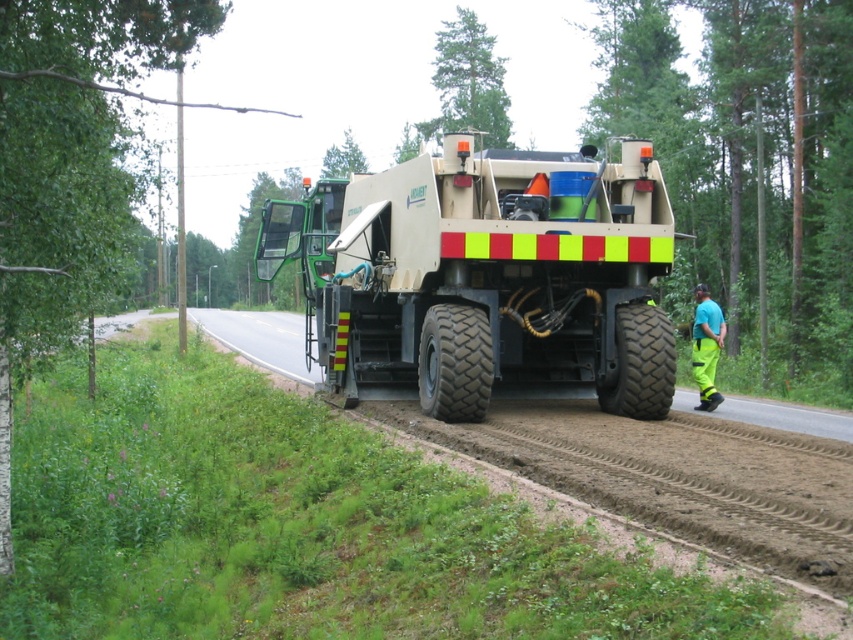
Question: Where is black rubber tire at center located in relation to black rubber tire at lower center in the image?

Choices:
 (A) left
 (B) right

Answer: (A)

Question: Is beige rubber garbage truck at center further to the viewer compared to black rubber tire at center?

Choices:
 (A) no
 (B) yes

Answer: (B)

Question: Can you confirm if beige rubber garbage truck at center is positioned to the right of black rubber tire at center?

Choices:
 (A) yes
 (B) no

Answer: (B)

Question: Which point is closer to the camera taking this photo?

Choices:
 (A) (709, 317)
 (B) (670, 380)
 (C) (462, 381)
 (D) (375, 344)

Answer: (C)

Question: Which point is closer to the camera?

Choices:
 (A) (625, 333)
 (B) (714, 368)
 (C) (482, 413)
 (D) (500, 387)

Answer: (C)

Question: Among these objects, which one is nearest to the camera?

Choices:
 (A) beige rubber garbage truck at center
 (B) neon yellow reflective pants at right

Answer: (A)